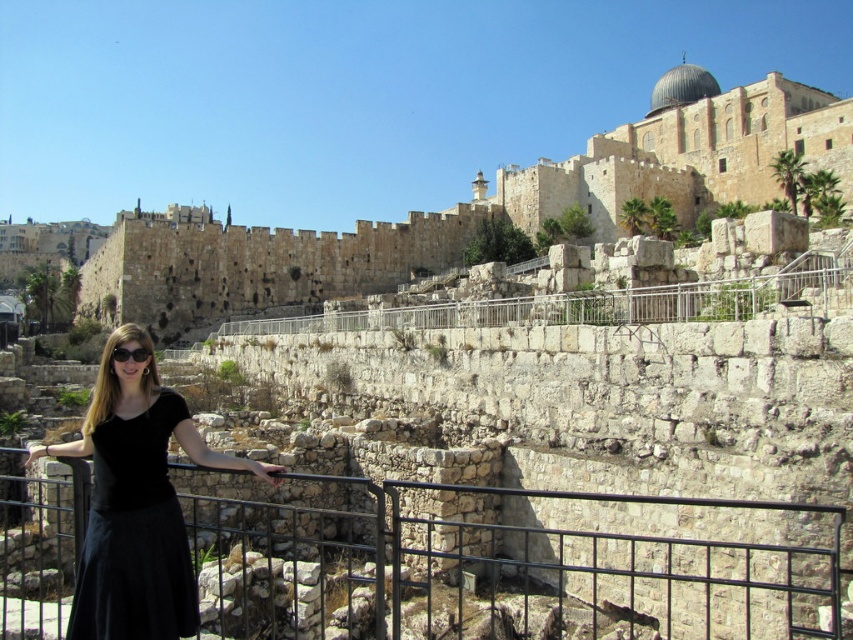
Question: Which point is closer to the camera?

Choices:
 (A) (108, 548)
 (B) (126, 404)
 (C) (122, 352)

Answer: (A)

Question: Can you confirm if brown stone wall at center is wider than black plastic goggles at center?

Choices:
 (A) yes
 (B) no

Answer: (A)

Question: Does brown stone wall at center appear on the right side of black matte skirt at lower left?

Choices:
 (A) yes
 (B) no

Answer: (B)

Question: Which of the following is the closest to the observer?

Choices:
 (A) (744, 129)
 (B) (596, 612)

Answer: (B)

Question: Considering the relative positions of black metal fence at center and black velvet dress at center in the image provided, where is black metal fence at center located with respect to black velvet dress at center?

Choices:
 (A) right
 (B) left

Answer: (B)

Question: Which object is farther from the camera taking this photo?

Choices:
 (A) black matte skirt at lower left
 (B) black metal fence at center
 (C) brown stone wall at center

Answer: (C)